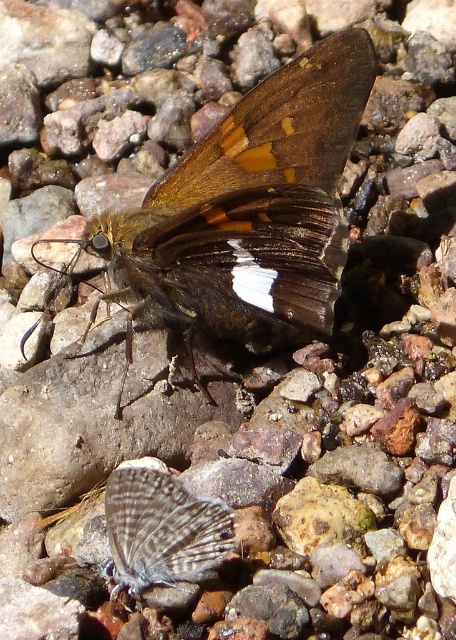
Question: Which of the following is the closest to the observer?

Choices:
 (A) speckled gray butterfly at center
 (B) shiny brown butterfly at center
 (C) brown matte wing at center

Answer: (A)

Question: Can you confirm if shiny brown butterfly at center is smaller than brown matte wing at center?

Choices:
 (A) no
 (B) yes

Answer: (A)

Question: Which object is the closest to the speckled gray butterfly at center?

Choices:
 (A) shiny brown butterfly at center
 (B) brown matte wing at center

Answer: (A)

Question: Can you confirm if brown matte wing at center is smaller than speckled gray butterfly at center?

Choices:
 (A) yes
 (B) no

Answer: (B)

Question: In this image, where is brown matte wing at center located relative to speckled gray butterfly at center?

Choices:
 (A) above
 (B) below

Answer: (A)

Question: Which point is closer to the camera?

Choices:
 (A) shiny brown butterfly at center
 (B) speckled gray butterfly at center

Answer: (B)